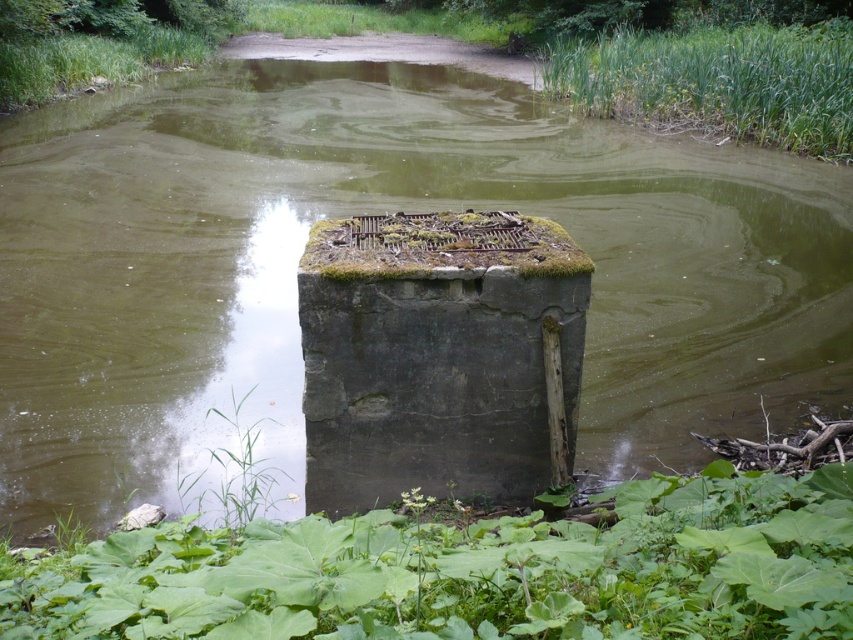
Does green leafy plant at lower center have a smaller size compared to green grass at upper left?

Yes.

Does green leafy plant at lower center have a greater width compared to green grass at upper left?

Correct, the width of green leafy plant at lower center exceeds that of green grass at upper left.

Is point (601, 595) farther from camera compared to point (201, 58)?

No, it is not.

You are a GUI agent. You are given a task and a screenshot of the screen. Output one action in this format:
    pyautogui.click(x=<x>, y=<y>)
    Task: Click on the green leafy plant at lower center
    The height and width of the screenshot is (640, 853).
    Given the screenshot: What is the action you would take?
    pyautogui.click(x=468, y=572)

Is dark gray concrete block at center bigger than green grassy reeds at upper right?

No.

Which is more to the left, dark gray concrete block at center or green grassy reeds at upper right?

From the viewer's perspective, dark gray concrete block at center appears more on the left side.

What do you see at coordinates (437, 355) in the screenshot? I see `dark gray concrete block at center` at bounding box center [437, 355].

I want to click on dark gray concrete block at center, so click(x=437, y=355).

Who is lower down, green leafy plant at lower center or dark gray concrete block at center?

Positioned lower is green leafy plant at lower center.

Between point (137, 605) and point (399, 288), which one is positioned behind?

The point (399, 288) is behind.

Image resolution: width=853 pixels, height=640 pixels. In order to click on green leafy plant at lower center in this screenshot , I will do `click(468, 572)`.